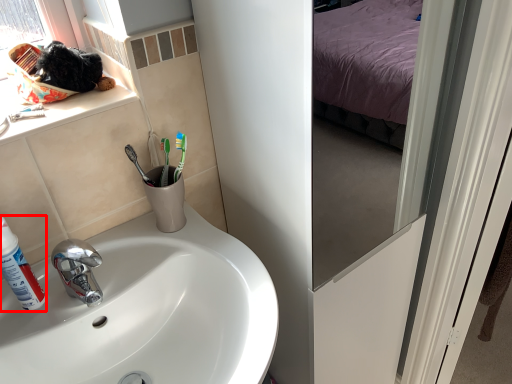
Question: From the image's perspective, what is the correct spatial relationship of shaving cream (annotated by the red box) in relation to sink?

Choices:
 (A) above
 (B) below

Answer: (A)